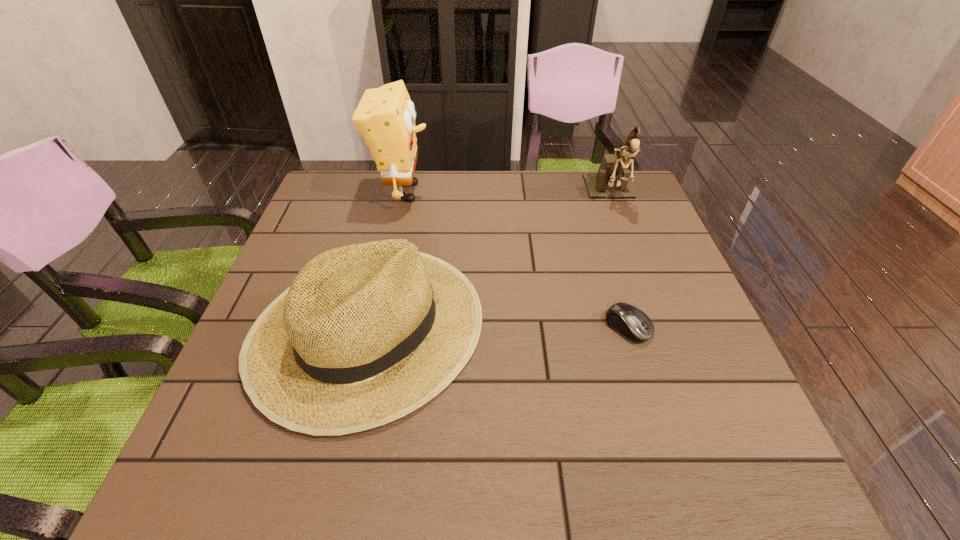
Find the location of a particular element. Image resolution: width=960 pixels, height=540 pixels. object at the near edge is located at coordinates (367, 333).

Find the location of a particular element. object at the left edge is located at coordinates (367, 333).

Where is `figurine present at the right edge`? This screenshot has width=960, height=540. figurine present at the right edge is located at coordinates (612, 180).

You are a GUI agent. You are given a task and a screenshot of the screen. Output one action in this format:
    pyautogui.click(x=<x>, y=<y>)
    Task: Click on the mouse situated at the right edge
    The width and height of the screenshot is (960, 540).
    Given the screenshot: What is the action you would take?
    pyautogui.click(x=631, y=322)

The height and width of the screenshot is (540, 960). I want to click on object present at the near left corner, so click(367, 333).

At what (x,y) coordinates should I click in order to perform the action: click on object positioned at the far right corner. Please return your answer as a coordinate pair (x, y). Image resolution: width=960 pixels, height=540 pixels. Looking at the image, I should click on (612, 180).

You are a GUI agent. You are given a task and a screenshot of the screen. Output one action in this format:
    pyautogui.click(x=<x>, y=<y>)
    Task: Click on the vacant space at the far edge of the desktop
    The image size is (960, 540).
    Given the screenshot: What is the action you would take?
    pyautogui.click(x=439, y=210)

In the image, there is a desktop. At what (x,y) coordinates should I click in order to perform the action: click on vacant space at the near edge. Please return your answer as a coordinate pair (x, y). This screenshot has height=540, width=960. Looking at the image, I should click on (413, 475).

Where is `vacant region at the right edge of the desktop`? This screenshot has width=960, height=540. vacant region at the right edge of the desktop is located at coordinates (615, 236).

Locate an element on the screen. free space at the far left corner of the desktop is located at coordinates (312, 208).